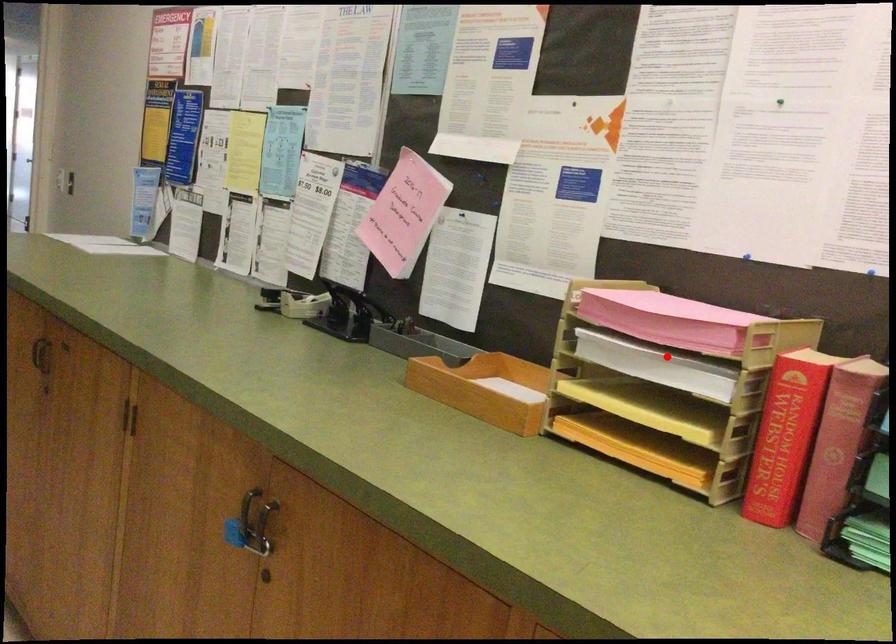
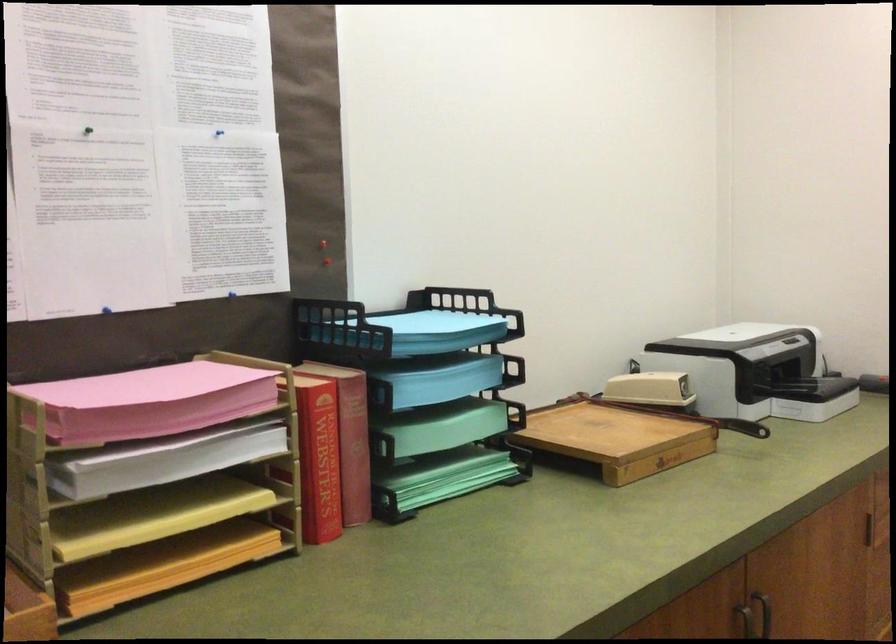
Where in the second image is the point corresponding to the highlighted location from the first image?

(179, 450)